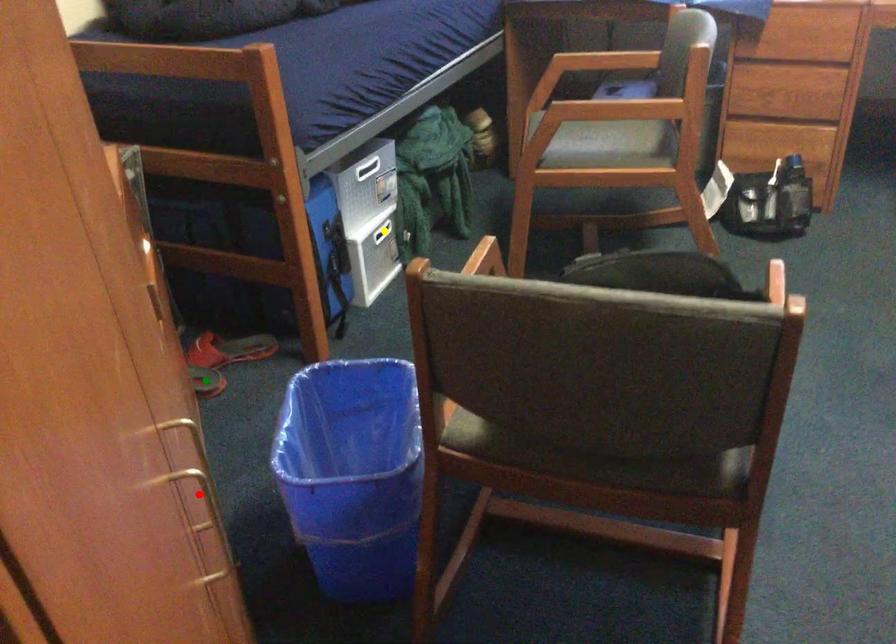
Order these from nearest to farthest:
A) red point
B) green point
C) yellow point

red point → green point → yellow point